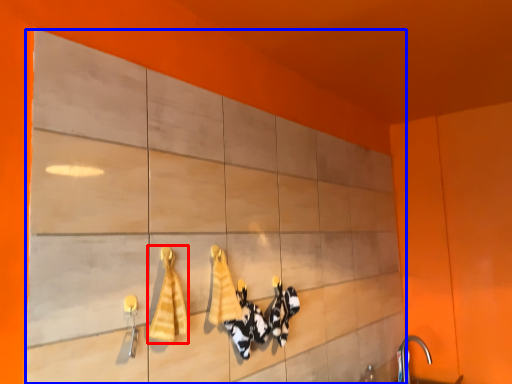
Question: Which object appears closest to the camera in this image, bath towel (highlighted by a red box) or cabinetry (highlighted by a blue box)?

Choices:
 (A) bath towel
 (B) cabinetry

Answer: (B)